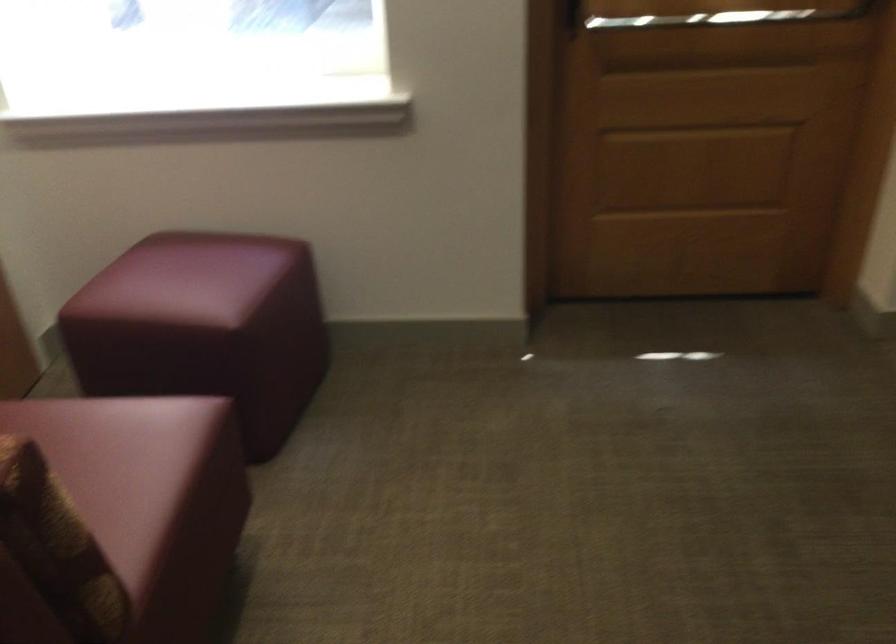
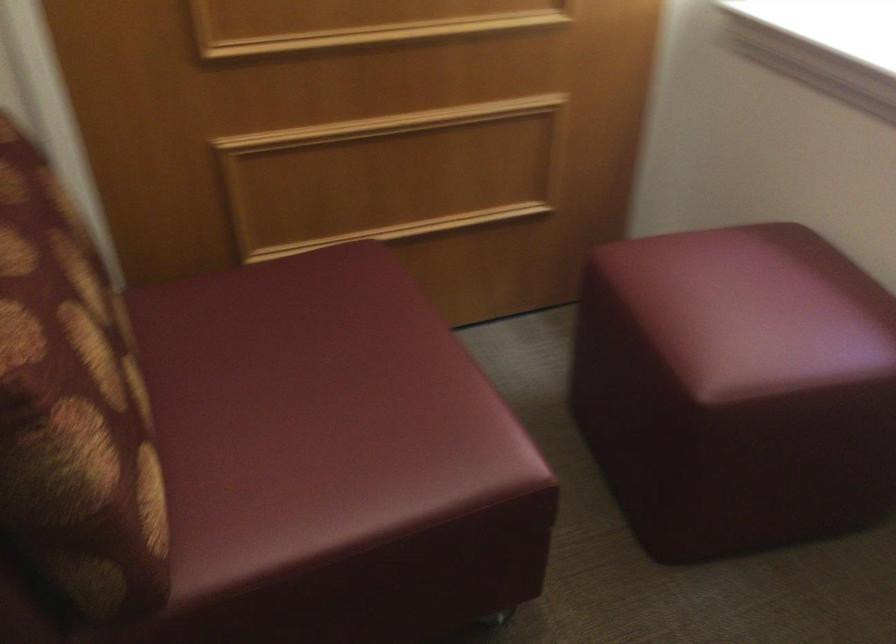
In the second image, find the point that corresponds to pixel 200 272 in the first image.

(752, 308)